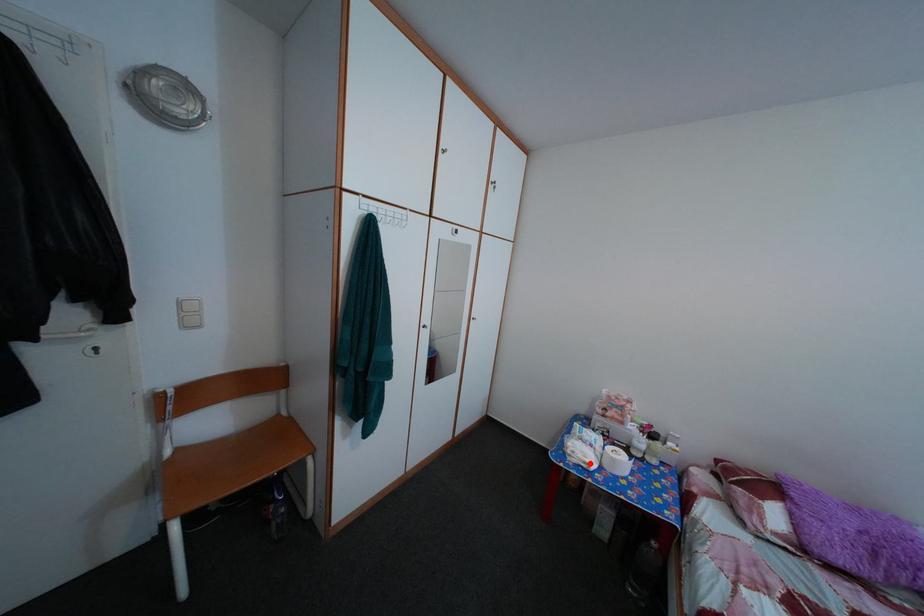
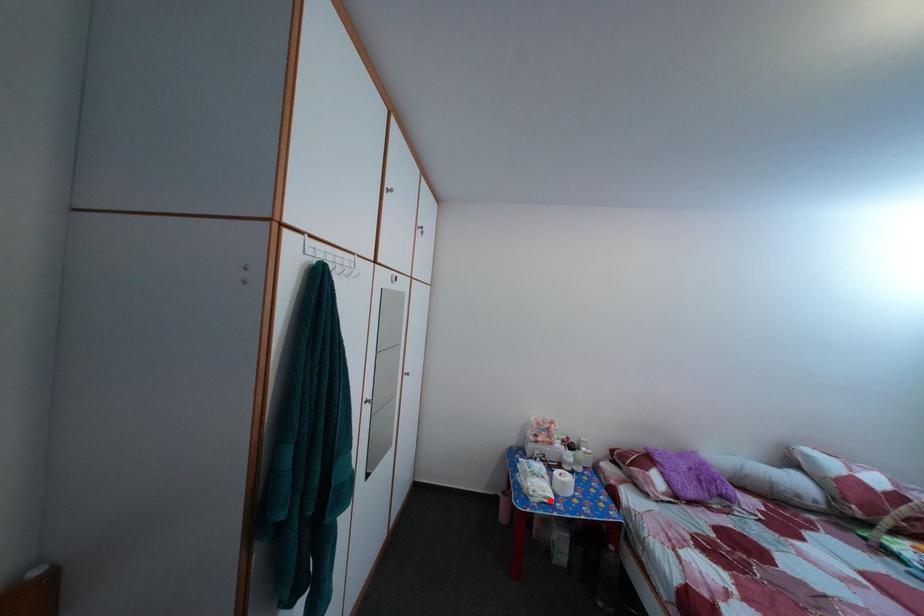
I am providing you with two images of the same scene from different viewpoints. A red point is marked on the first image and another point is marked on the second image. Do the highlighted points in image1 and image2 indicate the same real-world spot?

Yes